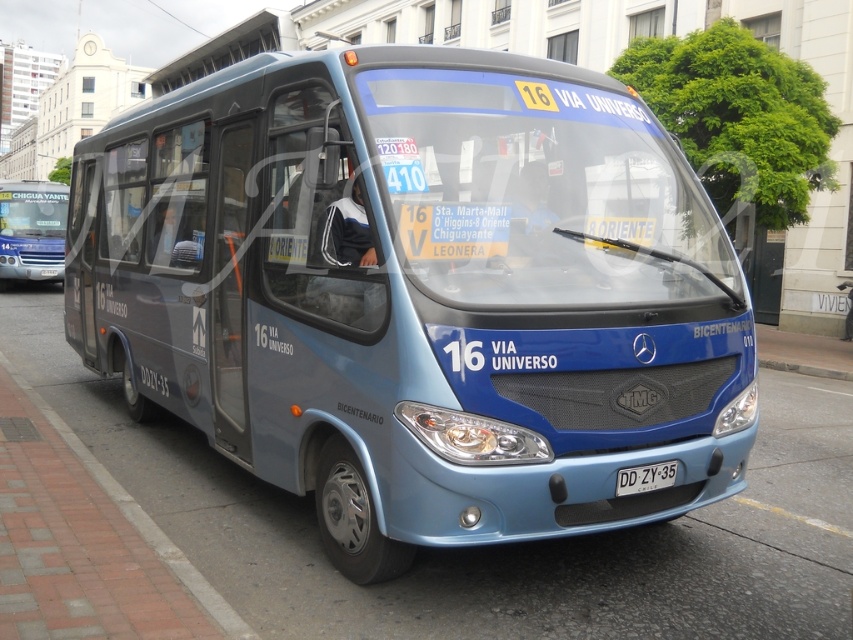
Question: Which is nearer to the blue metallic bus at center?

Choices:
 (A) matte blue bus at left
 (B) dark blue fabric jacket at center
 (C) white plastic license plate at center

Answer: (C)

Question: Can you confirm if brick pavement at lower left is bigger than dark blue fabric jacket at center?

Choices:
 (A) yes
 (B) no

Answer: (A)

Question: Which point appears farthest from the camera in this image?

Choices:
 (A) (621, 444)
 (B) (62, 211)
 (C) (624, 636)

Answer: (B)

Question: Which of the following is the closest to the observer?

Choices:
 (A) coord(357,177)
 (B) coord(38,243)
 (C) coord(389,296)
 (D) coord(792,586)

Answer: (C)

Question: Does blue metallic bus at center have a smaller size compared to matte blue bus at left?

Choices:
 (A) no
 (B) yes

Answer: (B)

Question: Does blue metallic bus at center appear on the right side of white plastic license plate at center?

Choices:
 (A) yes
 (B) no

Answer: (B)